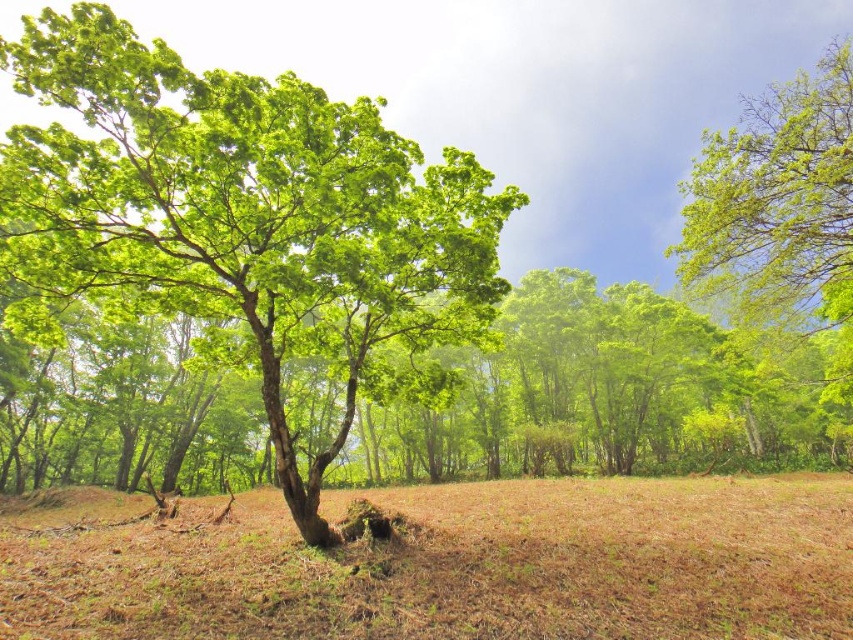
You are a drone operator flying a drone over a forest. You need to land the drone precisely at the brown dry grass at center. What are the coordinates where you should direct the drone to land?

The coordinates for the brown dry grass at center are at point (445, 564). Direct the drone to land there.

You are standing in the forest scene and want to locate two specific points marked in the image. The first point is at coordinate point (254,99) and the second is at point (845,86). Which point is nearer to your current position?

Point (254,99) is closer to the camera than point (845,86), so the first point is nearer to your current position.

You are standing in the forest scene and want to determine which of the two points, point (x=258, y=118) or point (x=816, y=497), is closer to you. Based on the description, which point is nearer?

Point (x=258, y=118) is closer to the camera than point (x=816, y=497), so it is the nearer point.